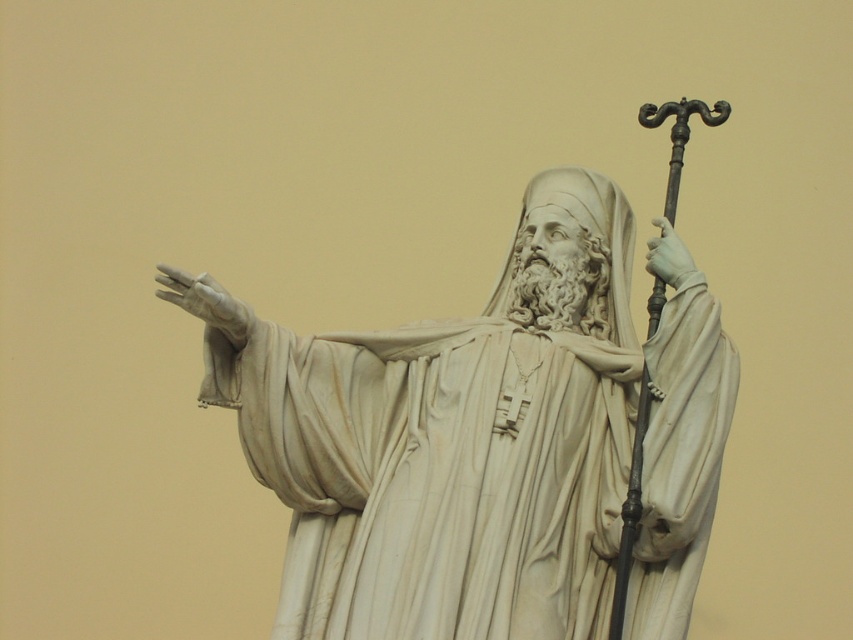
What is located at the coordinates point (492,445) in the image?

The white marble statue at center is located at point (492,445).